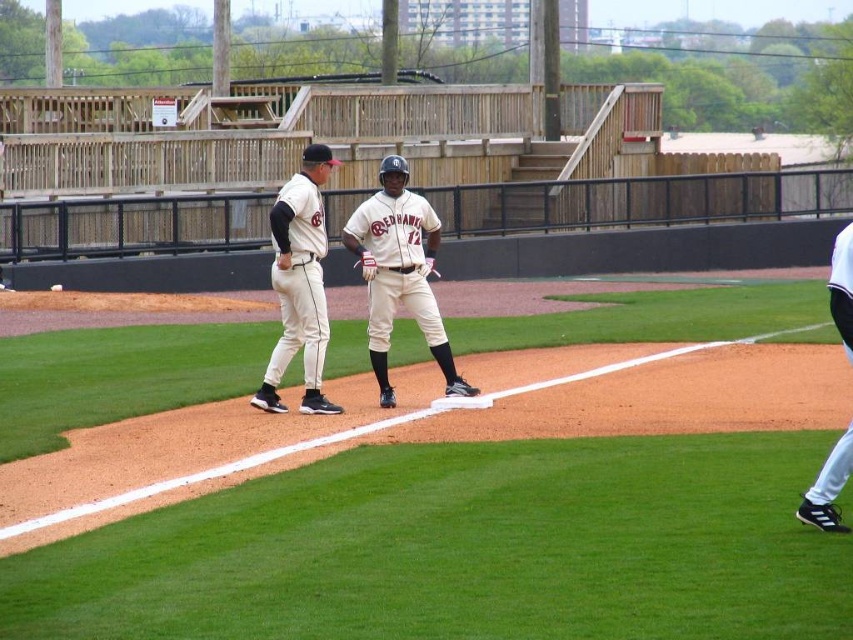
Can you confirm if white uniformed players at center is wider than white leather baseball glove at lower right?

Indeed, white uniformed players at center has a greater width compared to white leather baseball glove at lower right.

Who is more forward, [252,541] or [842,307]?

Point [252,541] is in front.

Image resolution: width=853 pixels, height=640 pixels. Identify the location of white uniformed players at center. (463, 548).

Can you confirm if white leather baseball glove at lower right is bigger than brown leather glove at center?

Correct, white leather baseball glove at lower right is larger in size than brown leather glove at center.

Image resolution: width=853 pixels, height=640 pixels. What do you see at coordinates (828, 486) in the screenshot?
I see `white leather baseball glove at lower right` at bounding box center [828, 486].

Locate an element on the screen. white leather baseball glove at lower right is located at coordinates (828, 486).

Does white uniformed players at center appear over brown leather glove at center?

No.

Find the location of a particular element. The image size is (853, 640). white uniformed players at center is located at coordinates (463, 548).